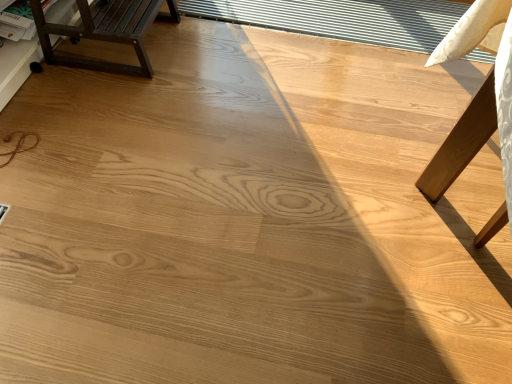
This screenshot has width=512, height=384. Identify the location of vacant region below transparent plastic window at upper center (from a real-world perspective). click(x=382, y=24).